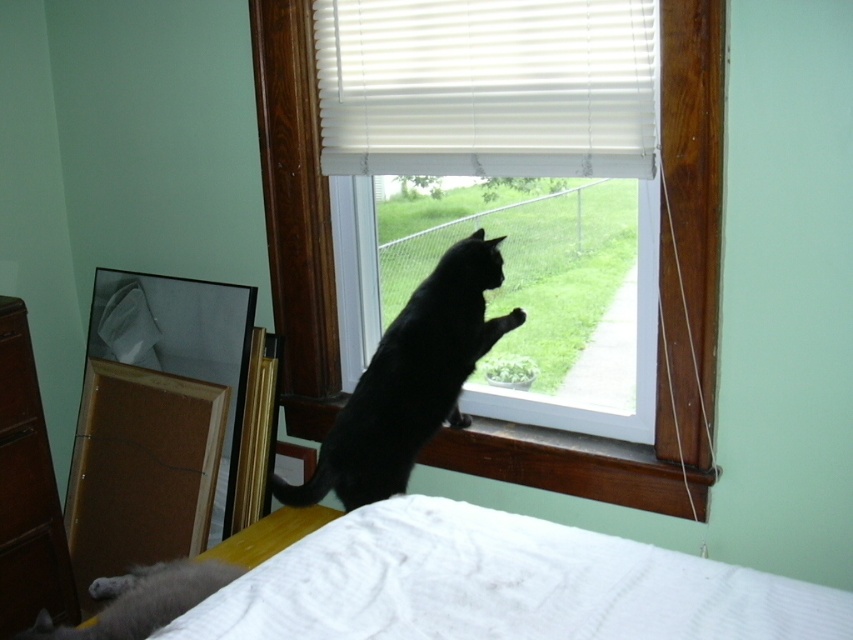
Is white matte window at center above wooden at lower center?

Yes, white matte window at center is above wooden at lower center.

Is point (708, 280) positioned before point (660, 474)?

Yes, point (708, 280) is closer to viewer.

Between point (689, 406) and point (572, 484), which one is positioned behind?

Positioned behind is point (572, 484).

At what (x,y) coordinates should I click in order to perform the action: click on white matte window at center. Please return your answer as a coordinate pair (x, y). The width and height of the screenshot is (853, 640). Looking at the image, I should click on (x=660, y=310).

Does soft gray cat at lower left come behind brushed wood drawer at lower left?

No, it is not.

Does soft gray cat at lower left have a larger size compared to brushed wood drawer at lower left?

Correct, soft gray cat at lower left is larger in size than brushed wood drawer at lower left.

Which is in front, point (216, 563) or point (28, 484)?

Point (216, 563)

This screenshot has height=640, width=853. Identify the location of soft gray cat at lower left. (142, 600).

Which is in front, point (584, 564) or point (456, 268)?

Point (584, 564)

Who is more distant from viewer, [711,573] or [389,449]?

Positioned behind is point [389,449].

Where is `white textured bed at lower center`? white textured bed at lower center is located at coordinates (500, 586).